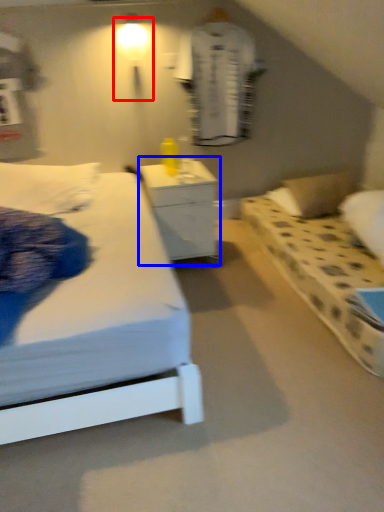
Question: Which object is further to the camera taking this photo, light fixture (highlighted by a red box) or nightstand (highlighted by a blue box)?

Choices:
 (A) light fixture
 (B) nightstand

Answer: (A)